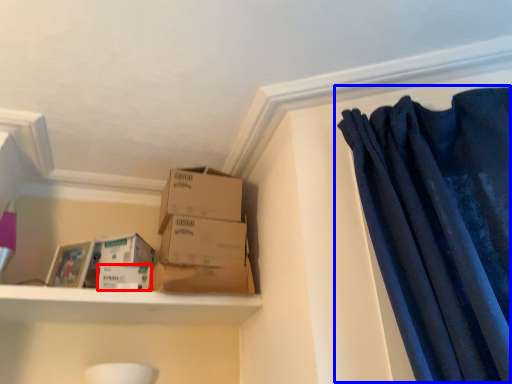
Question: Which object is closer to the camera taking this photo, storage box (highlighted by a red box) or curtain (highlighted by a blue box)?

Choices:
 (A) storage box
 (B) curtain

Answer: (B)